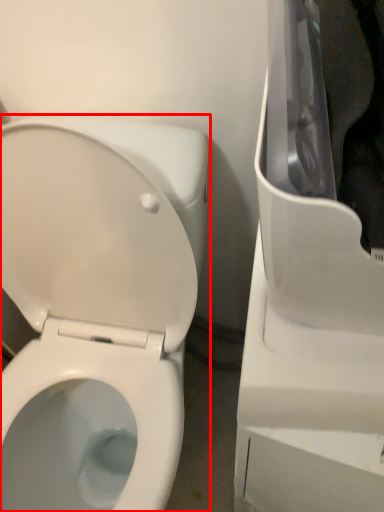
Question: Considering the relative positions of toilet (annotated by the red box) and appliance in the image provided, where is toilet (annotated by the red box) located with respect to the staircase?

Choices:
 (A) left
 (B) right

Answer: (A)